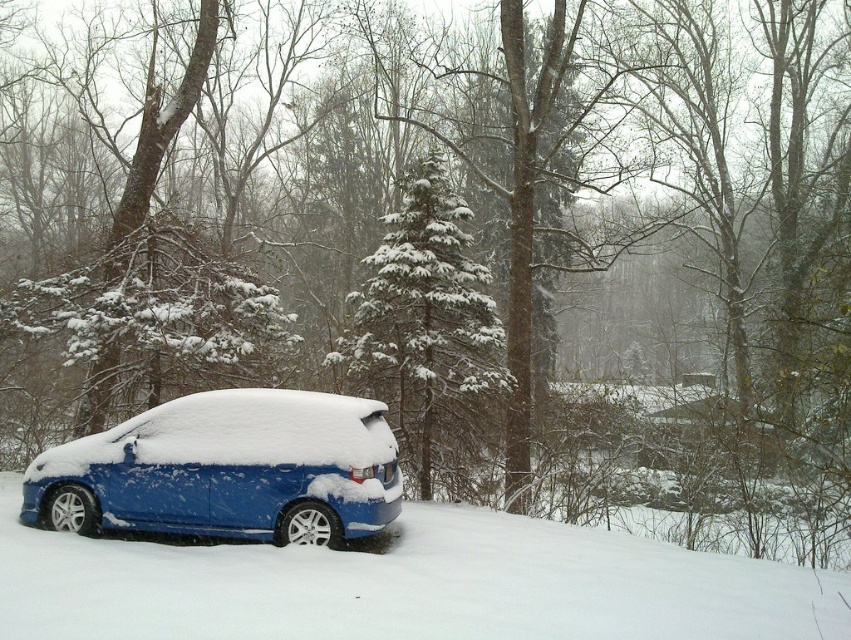
From the picture: You are a delivery person trying to park your delivery van in the parking lot. You see the slick blue car at lower left and the blue metallic hatchback at lower left. How far apart are these two vehicles?

The slick blue car at lower left is 1.26 meters away from blue metallic hatchback at lower left.